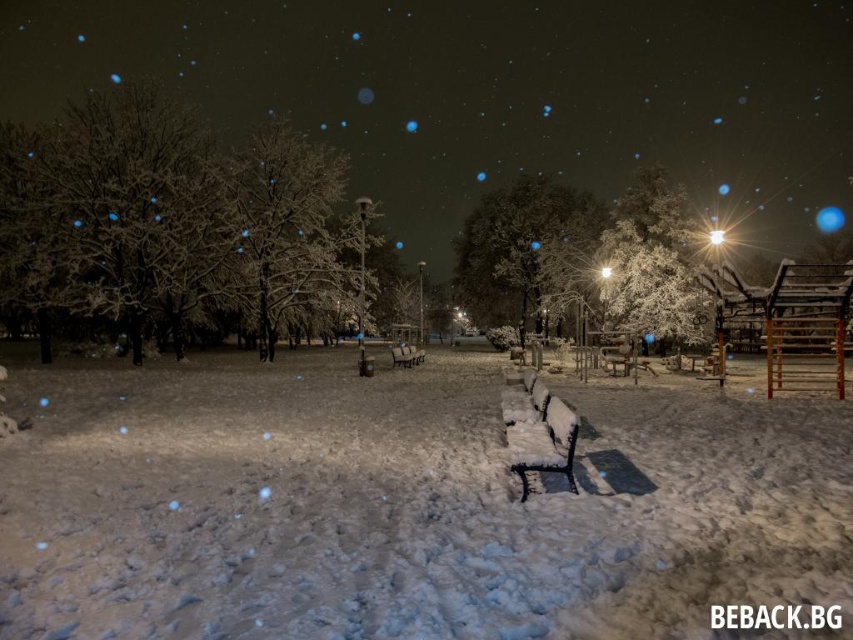
You are a snowman builder and want to sit on the wooden bench at center to rest. However, the white fluffy snow at center is covering part of it. Is the snow on top of the bench or underneath it?

The white fluffy snow at center is below the wooden bench at center, so the snow is underneath the bench. You can sit on the bench without the snow being in the way.

You are planning to place a snowman on the wooden bench at center. Given the size of the bench and the tree, will the snowman fit comfortably without touching the white frosty tree at right?

The white frosty tree at right is wider than the wooden bench at center. Since the tree is wider, the snowman might not fit comfortably on the bench without being close to the tree.